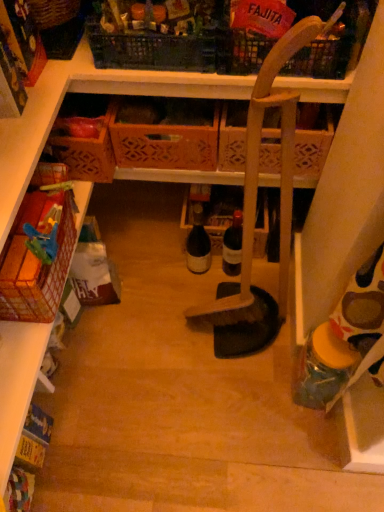
Find the location of a particular element. Image resolution: width=384 pixels, height=512 pixels. vacant area in front of wooden broom at center is located at coordinates click(x=233, y=378).